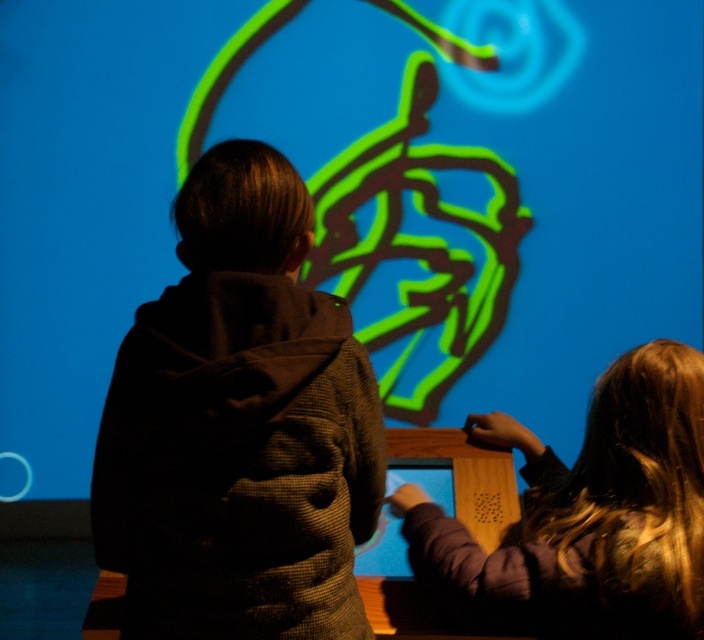
Question: Among these points, which one is nearest to the camera?

Choices:
 (A) (639, 417)
 (B) (180, 300)

Answer: (B)

Question: Which point is closer to the camera?

Choices:
 (A) (667, 348)
 (B) (272, 417)

Answer: (B)

Question: Observing the image, what is the correct spatial positioning of dark brown textured hoodie at center in reference to smooth purple sweater at lower right?

Choices:
 (A) right
 (B) left

Answer: (B)

Question: Which of the following is the closest to the observer?

Choices:
 (A) smooth purple sweater at lower right
 (B) dark brown textured hoodie at center

Answer: (B)

Question: Does dark brown textured hoodie at center appear on the left side of smooth purple sweater at lower right?

Choices:
 (A) no
 (B) yes

Answer: (B)

Question: Is dark brown textured hoodie at center thinner than smooth purple sweater at lower right?

Choices:
 (A) yes
 (B) no

Answer: (A)